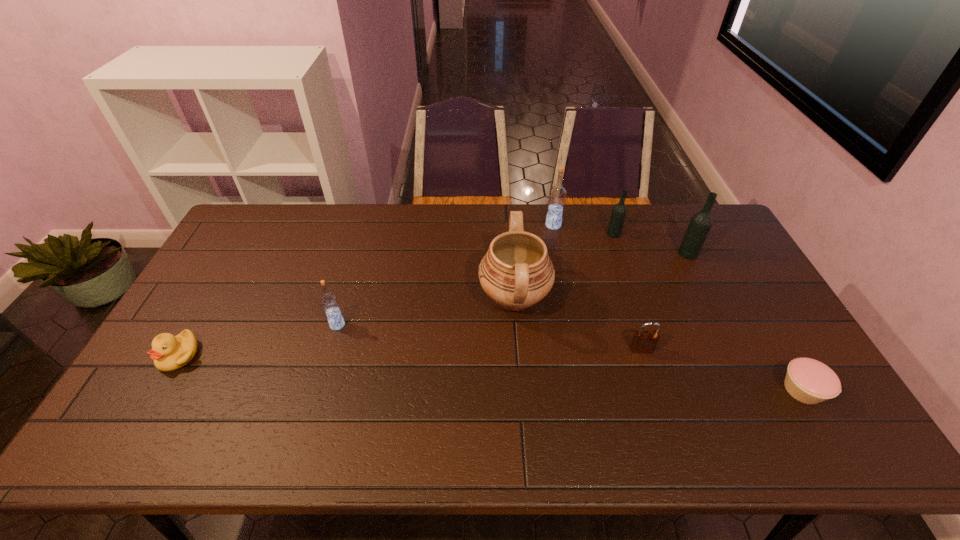
Find the location of a particular element. The height and width of the screenshot is (540, 960). vacant region at the left edge of the desktop is located at coordinates (205, 354).

The width and height of the screenshot is (960, 540). I want to click on free region at the right edge of the desktop, so click(783, 394).

The height and width of the screenshot is (540, 960). I want to click on vacant space at the far left corner of the desktop, so click(x=244, y=226).

This screenshot has width=960, height=540. I want to click on vacant area that lies between the leftmost object and the fifth object from right to left, so click(366, 290).

At what (x,y) coordinates should I click in order to perform the action: click on free space between the brown padlock and the fourth object from left to right. Please return your answer as a coordinate pair (x, y). Looking at the image, I should click on (597, 287).

Where is `free space between the sixth object from right to left and the smaller blue vodka`? free space between the sixth object from right to left and the smaller blue vodka is located at coordinates (426, 311).

Locate an element on the screen. The width and height of the screenshot is (960, 540). free space between the padlock and the second vodka from left to right is located at coordinates (597, 287).

This screenshot has height=540, width=960. Find the location of `vacant region between the bigger black vodka and the rightmost object`. vacant region between the bigger black vodka and the rightmost object is located at coordinates (745, 321).

Locate an element on the screen. This screenshot has height=540, width=960. free space between the brown padlock and the second vodka from left to right is located at coordinates (597, 287).

Find the location of `vacant area that lies between the second vodka from right to left and the smaller blue vodka`. vacant area that lies between the second vodka from right to left and the smaller blue vodka is located at coordinates (475, 279).